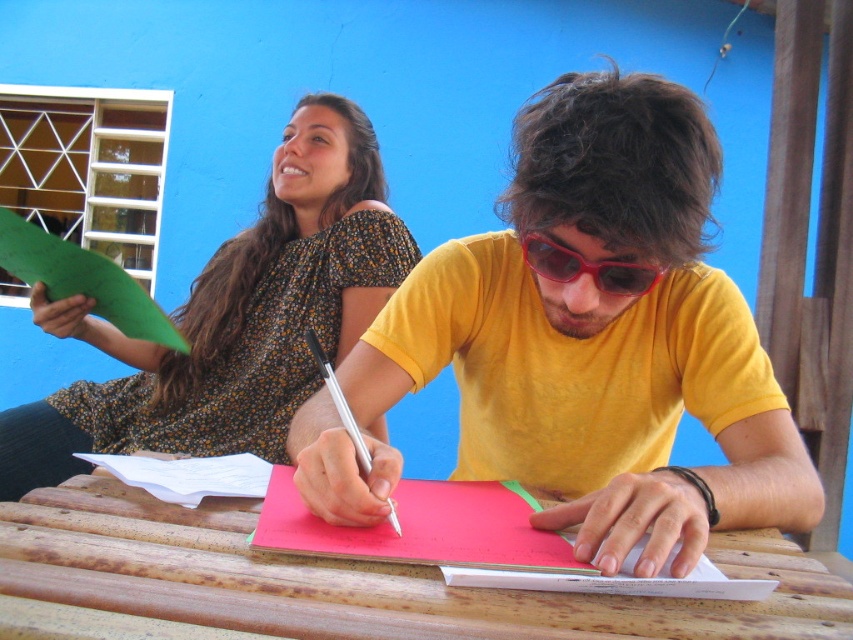
Who is positioned more to the right, floral dress at upper left or white paper at center?

From the viewer's perspective, white paper at center appears more on the right side.

Which is below, floral dress at upper left or white paper at center?

white paper at center is lower down.

Locate an element on the screen. The image size is (853, 640). floral dress at upper left is located at coordinates (233, 317).

Who is taller, yellow matte shirt at center or wooden at center?

Standing taller between the two is yellow matte shirt at center.

Between yellow matte shirt at center and wooden at center, which one has less height?

wooden at center

Does point (479, 384) come in front of point (819, 636)?

No, it is not.

At what (x,y) coordinates should I click in order to perform the action: click on yellow matte shirt at center. Please return your answer as a coordinate pair (x, y). Looking at the image, I should click on (601, 337).

Between floral dress at upper left and red plastic sunglasses at center, which one has less height?

red plastic sunglasses at center

Is floral dress at upper left in front of red plastic sunglasses at center?

No, floral dress at upper left is further to the viewer.

Describe the element at coordinates (233, 317) in the screenshot. I see `floral dress at upper left` at that location.

Locate an element on the screen. This screenshot has width=853, height=640. floral dress at upper left is located at coordinates (233, 317).